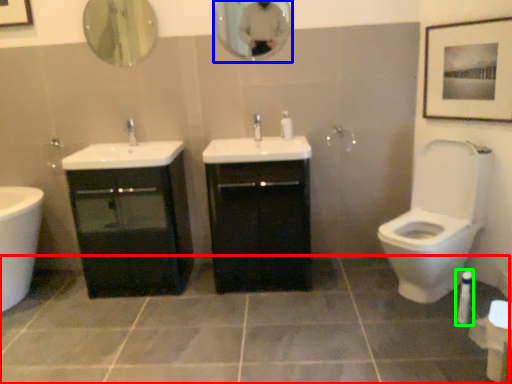
Question: Based on their relative distances, which object is nearer to ceramic tile (highlighted by a red box)? Choose from mirror (highlighted by a blue box) and toiletry (highlighted by a green box).

Choices:
 (A) mirror
 (B) toiletry

Answer: (B)